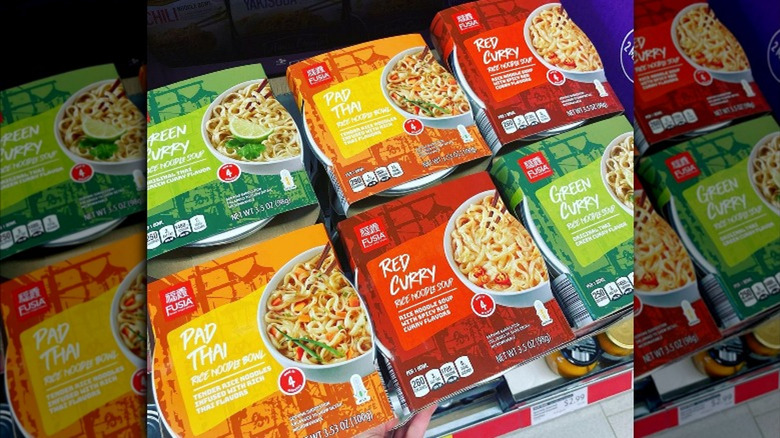
Find the location of a particular element. floor is located at coordinates pyautogui.click(x=598, y=418), pyautogui.click(x=743, y=427).